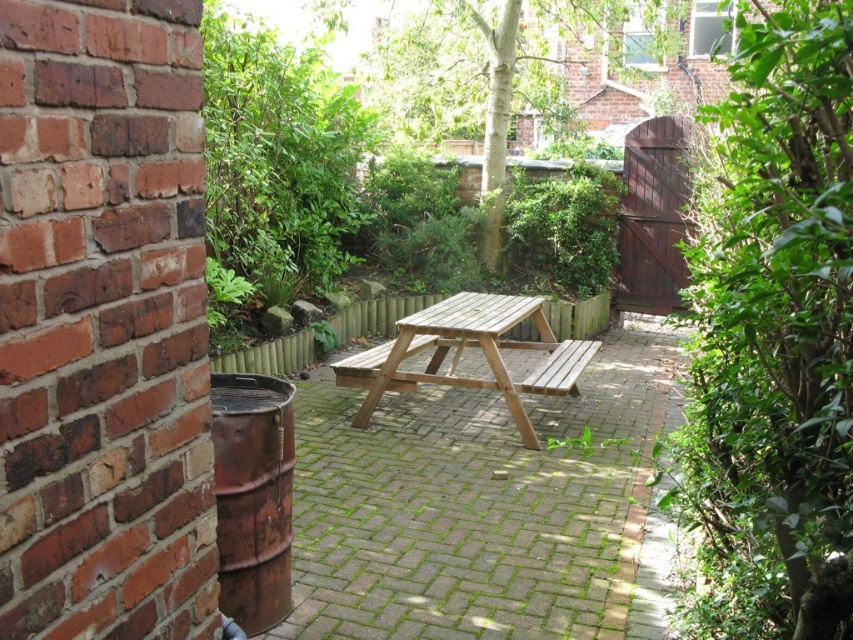
Is wooden picnic table at center smaller than natural wood picnic table at center?

Incorrect, wooden picnic table at center is not smaller in size than natural wood picnic table at center.

Who is more distant from viewer, (344, 541) or (432, 332)?

Point (432, 332)

Locate an element on the screen. wooden picnic table at center is located at coordinates (482, 508).

Can you confirm if wooden picnic table at center is smaller than wooden bench at center?

Incorrect, wooden picnic table at center is not smaller in size than wooden bench at center.

Is wooden picnic table at center to the left of wooden bench at center from the viewer's perspective?

Yes, wooden picnic table at center is to the left of wooden bench at center.

Who is more forward, (631, 545) or (534, 376)?

Point (631, 545) is more forward.

Locate an element on the screen. The width and height of the screenshot is (853, 640). wooden picnic table at center is located at coordinates (482, 508).

Is point (576, 353) farther from viewer compared to point (579, 364)?

Yes, point (576, 353) is farther from viewer.

Can you confirm if natural wood picnic table at center is positioned to the right of wooden bench at center?

No, natural wood picnic table at center is not to the right of wooden bench at center.

Who is more forward, [361,376] or [560,392]?

Point [560,392]

At what (x,y) coordinates should I click in order to perform the action: click on natural wood picnic table at center. Please return your answer as a coordinate pair (x, y). The width and height of the screenshot is (853, 640). Looking at the image, I should click on (462, 349).